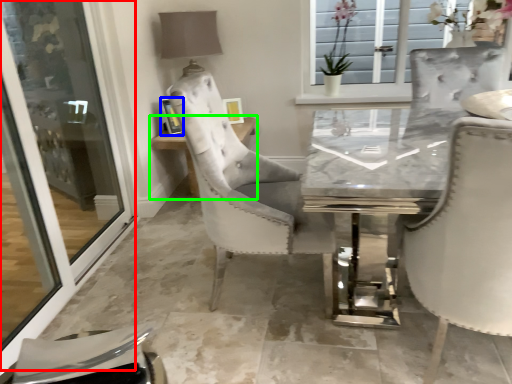
Question: Which is nearer to the screen door (highlighted by a red box)? picture frame (highlighted by a blue box) or table (highlighted by a green box).

Choices:
 (A) picture frame
 (B) table

Answer: (B)